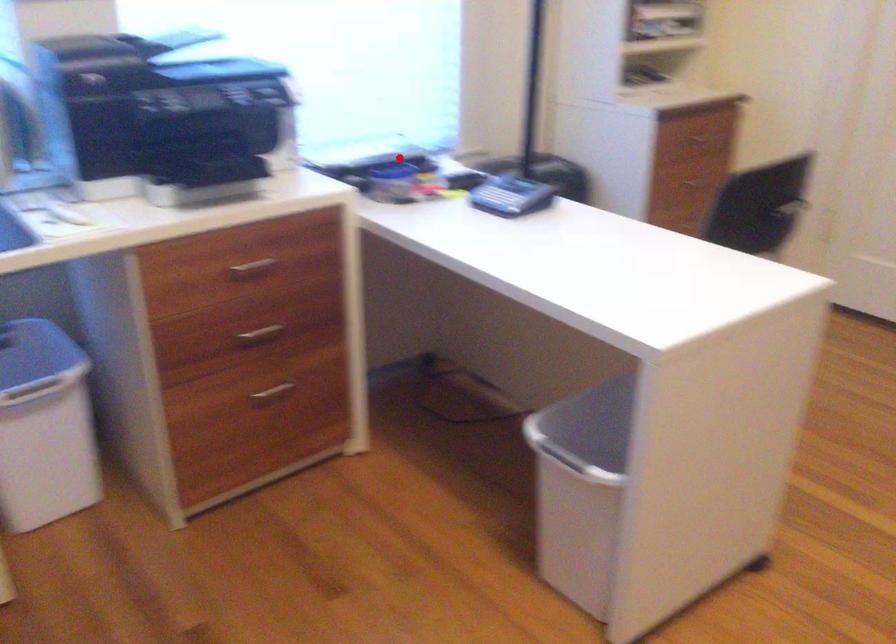
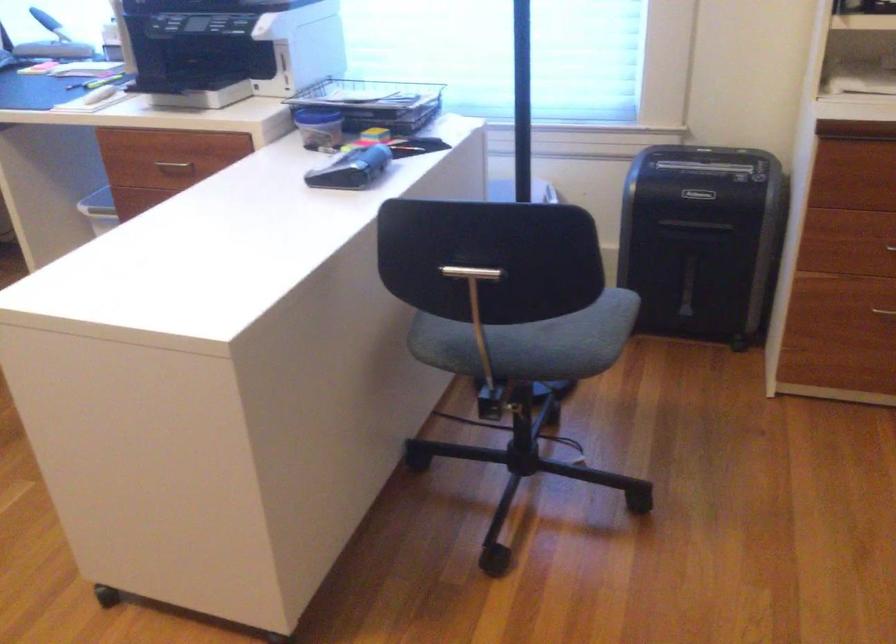
In the second image, find the point that corresponds to the highlighted location in the first image.

(374, 102)